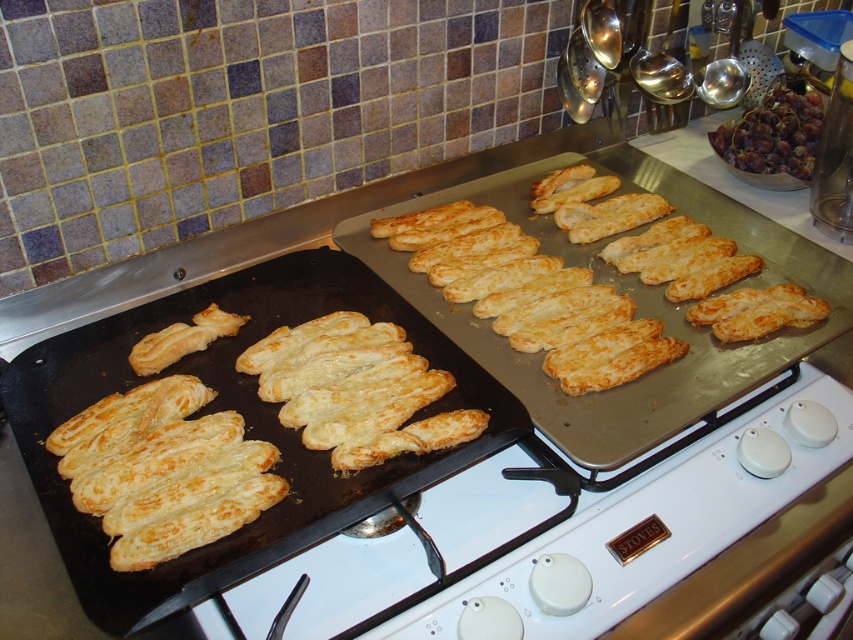
You are a baker who just took out two trays of pastries from the oven. You need to arrange them on the stovetop so that they cool evenly. The golden brown puff pastry at left and the golden brown puff pastry at center are both on the stovetop. Which pastry is closer to the left edge of the stovetop?

The golden brown puff pastry at left is closer to the left edge of the stovetop since it is positioned on the left side of the golden brown puff pastry at center.

You are a chef preparing to plate desserts. You have a golden brown puff pastry at center and shiny metallic grapes at upper right. Which item is wider when placed side by side?

The golden brown puff pastry at center is wider than the shiny metallic grapes at upper right.

You are a chef standing in front of the stovetop. You need to reach the golden flaky pastry at center to check its temperature. Can you reach it without moving the golden crispy pastry at center?

The golden flaky pastry at center is behind the golden crispy pastry at center, so you cannot reach it without moving the golden crispy pastry at center first.